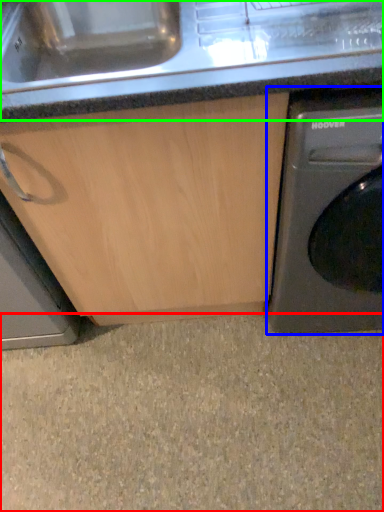
Question: Considering the real-world distances, which object is farthest from granite (highlighted by a red box)? washing machine (highlighted by a blue box) or counter top (highlighted by a green box)?

Choices:
 (A) washing machine
 (B) counter top

Answer: (B)